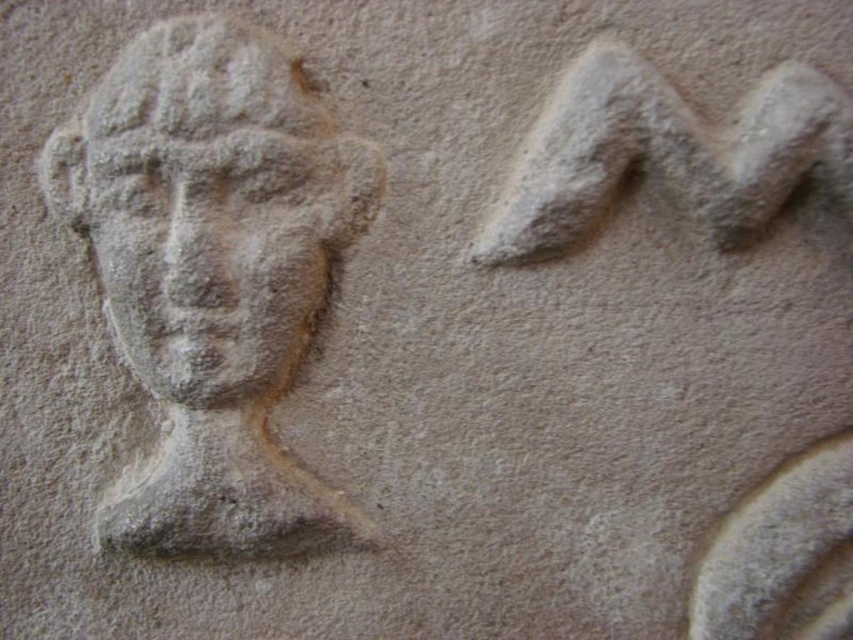
Measure the distance from gray stone head at left to gray stone face at center.

gray stone head at left is 0.84 centimeters from gray stone face at center.

Is point (239, 173) closer to camera compared to point (260, 212)?

Yes, it is in front of point (260, 212).

Image resolution: width=853 pixels, height=640 pixels. Identify the location of gray stone head at left. 210,205.